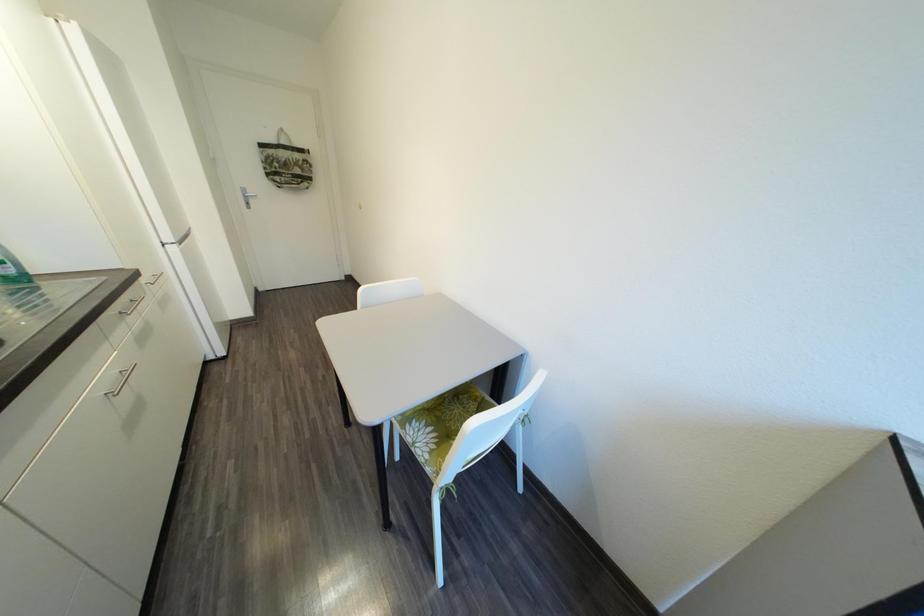
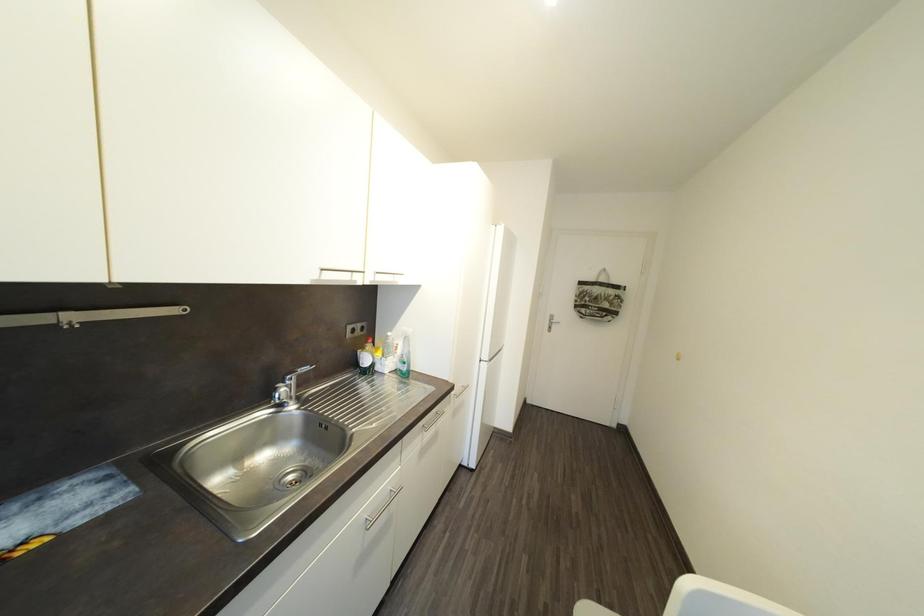
Question: The camera is either moving clockwise (left) or counter-clockwise (right) around the object. The first image is from the beginning of the video and the second image is from the end. Is the camera moving left or right when shooting the video?

Choices:
 (A) Left
 (B) Right

Answer: (B)